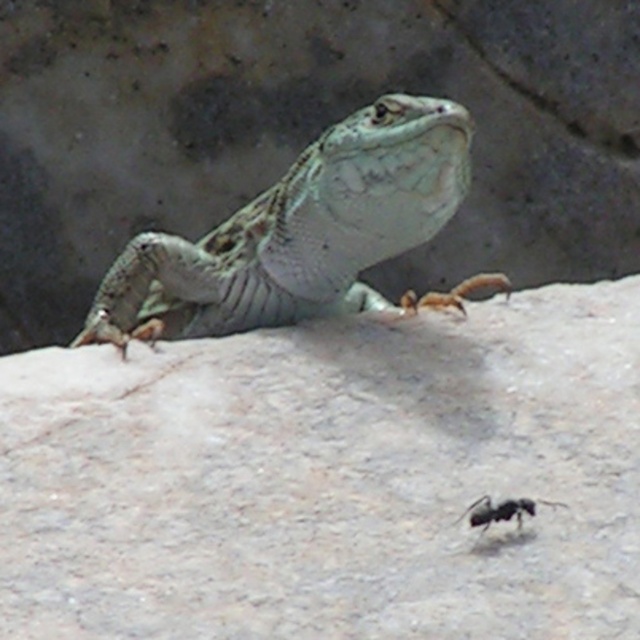
From the picture: Which of these two, speckled green lizard at center or black matte ant at lower center, stands taller?

speckled green lizard at center is taller.

The height and width of the screenshot is (640, 640). What do you see at coordinates (304, 234) in the screenshot?
I see `speckled green lizard at center` at bounding box center [304, 234].

This screenshot has width=640, height=640. What do you see at coordinates (304, 234) in the screenshot?
I see `speckled green lizard at center` at bounding box center [304, 234].

Locate an element on the screen. This screenshot has width=640, height=640. speckled green lizard at center is located at coordinates (304, 234).